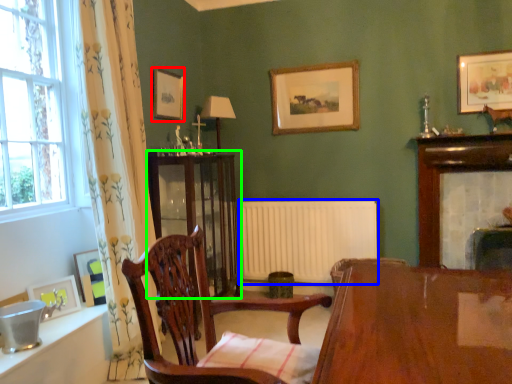
Question: Which object is the farthest from picture frame (highlighted by a red box)? Choose among these: radiator (highlighted by a blue box) or cabinetry (highlighted by a green box).

Choices:
 (A) radiator
 (B) cabinetry

Answer: (A)